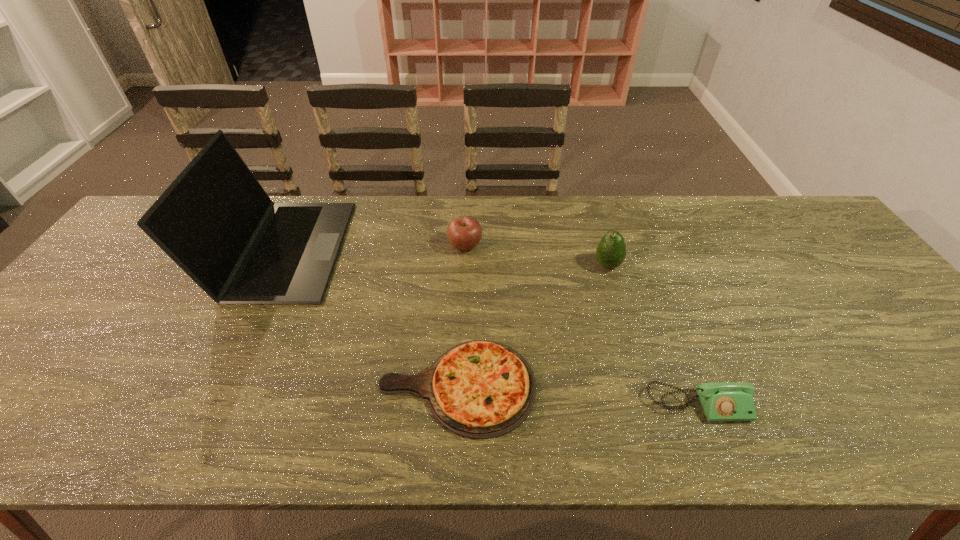
Where is `vacant space in between the avocado and the shortest object`? This screenshot has width=960, height=540. vacant space in between the avocado and the shortest object is located at coordinates (532, 326).

I want to click on vacant area that lies between the third shortest object and the tallest object, so click(x=373, y=247).

Image resolution: width=960 pixels, height=540 pixels. Identify the location of free point between the leftmost object and the second shortest object. (491, 327).

The height and width of the screenshot is (540, 960). In order to click on vacant space that's between the pizza and the fourth tallest object in this screenshot , I will do `click(577, 395)`.

What are the coordinates of `vacant area between the pizza and the second tallest object` in the screenshot? It's located at (532, 326).

This screenshot has width=960, height=540. I want to click on free space between the apple and the fourth shortest object, so click(537, 255).

Find the location of a particular element. Image resolution: width=960 pixels, height=540 pixels. free space between the avocado and the second shortest object is located at coordinates (653, 335).

The width and height of the screenshot is (960, 540). Find the location of `free point between the avocado and the apple`. free point between the avocado and the apple is located at coordinates (537, 255).

At what (x,y) coordinates should I click in order to perform the action: click on object that stands as the third closest to the third tallest object. Please return your answer as a coordinate pair (x, y). Looking at the image, I should click on [611, 251].

Locate an element on the screen. object that is the second closest to the fourth tallest object is located at coordinates (611, 251).